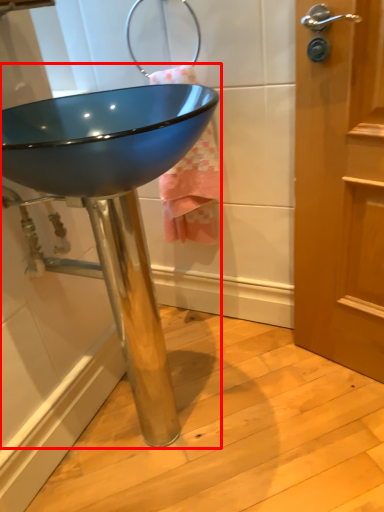
Question: From the image's perspective, where is sink (annotated by the red box) located in relation to bath towel in the image?

Choices:
 (A) below
 (B) above

Answer: (A)